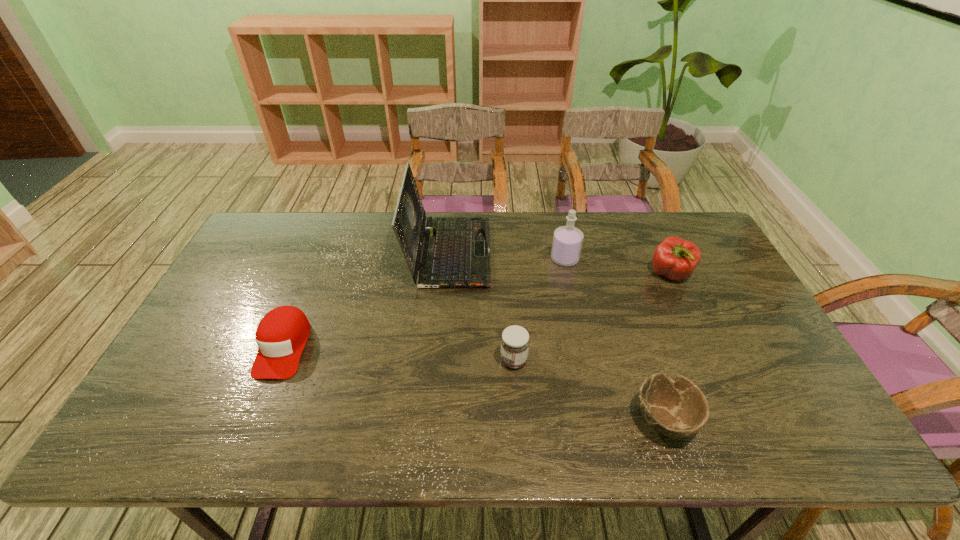
Image resolution: width=960 pixels, height=540 pixels. Identify the location of free spot between the jam and the rightmost object. (592, 318).

This screenshot has width=960, height=540. What are the coordinates of `free spot between the leftmost object and the perfume` in the screenshot? It's located at (424, 303).

Where is `vacant space that is in between the leftmost object and the fourth object from left to right`? This screenshot has width=960, height=540. vacant space that is in between the leftmost object and the fourth object from left to right is located at coordinates (424, 303).

Where is `free spot between the second object from right to left and the second object from left to right`? The width and height of the screenshot is (960, 540). free spot between the second object from right to left and the second object from left to right is located at coordinates click(557, 336).

I want to click on vacant area that lies between the perfume and the third tallest object, so click(x=617, y=267).

Find the location of a particular element. The image size is (960, 540). unoccupied position between the rightmost object and the fifth shortest object is located at coordinates pyautogui.click(x=617, y=267).

Identify which object is the fourth nearest to the perfume. Please provide its 2D coordinates. Your answer should be formatted as a tuple, i.e. [(x, y)], where the tuple contains the x and y coordinates of a point satisfying the conditions above.

[(677, 408)]

Identify which object is the second closest to the nearest object. Please provide its 2D coordinates. Your answer should be formatted as a tuple, i.e. [(x, y)], where the tuple contains the x and y coordinates of a point satisfying the conditions above.

[(675, 258)]

The height and width of the screenshot is (540, 960). Identify the location of vacant region that satisfies the following two spatial constraints: 1. on the front side of the perfume; 2. on the front label of the fourth object from right to left. (587, 360).

Identify the location of free space in the image that satisfies the following two spatial constraints: 1. on the screen of the tallest object; 2. on the front-facing side of the baseball cap. This screenshot has height=540, width=960. (442, 347).